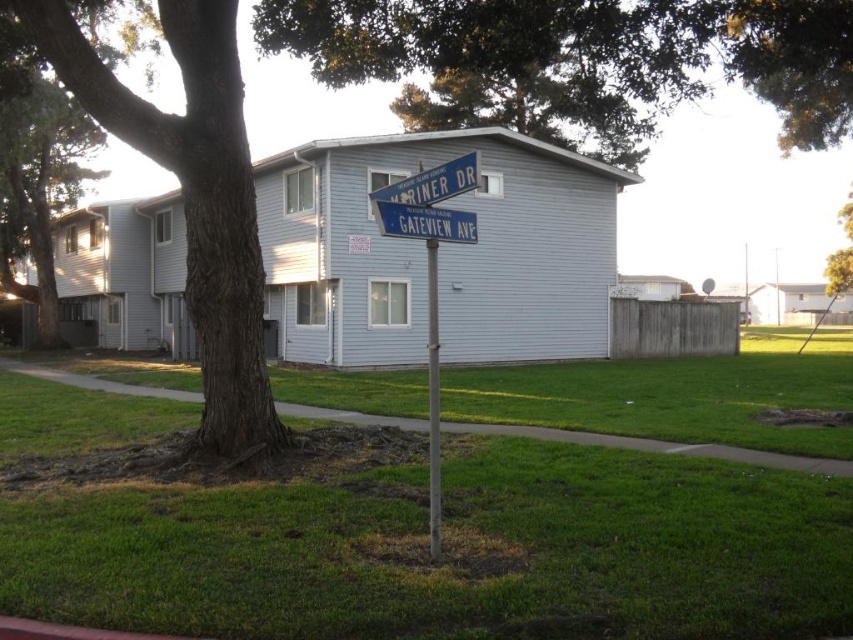
Question: Which object is positioned closest to the green grass at center?

Choices:
 (A) blue plastic street sign at center
 (B) yellow leafy tree at upper right
 (C) green textured tree at left
 (D) blue plastic street sign at upper center

Answer: (D)

Question: Is green grass at center closer to camera compared to brown rough bark tree at left?

Choices:
 (A) yes
 (B) no

Answer: (A)

Question: Considering the real-world distances, which object is closest to the yellow leafy tree at upper right?

Choices:
 (A) blue plastic street sign at upper center
 (B) green grass at center

Answer: (B)

Question: Which point is farther to the camera?

Choices:
 (A) green grass at center
 (B) metallic pole at center
 (C) green textured tree at left

Answer: (C)

Question: Can you confirm if blue plastic street sign at center is thinner than yellow leafy tree at upper right?

Choices:
 (A) yes
 (B) no

Answer: (A)

Question: Is brown rough bark tree at left closer to camera compared to blue plastic street sign at center?

Choices:
 (A) no
 (B) yes

Answer: (A)